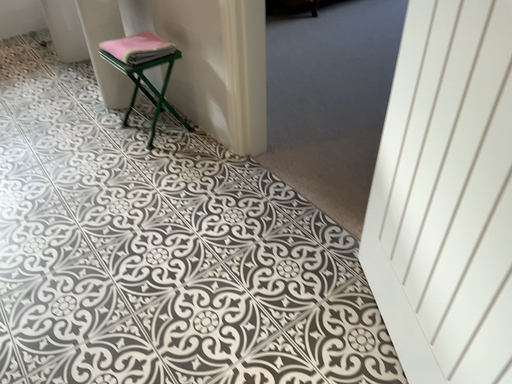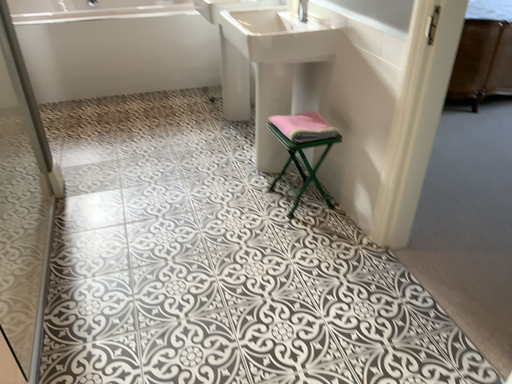
Question: Which way did the camera rotate in the video?

Choices:
 (A) rotated left
 (B) rotated right

Answer: (A)